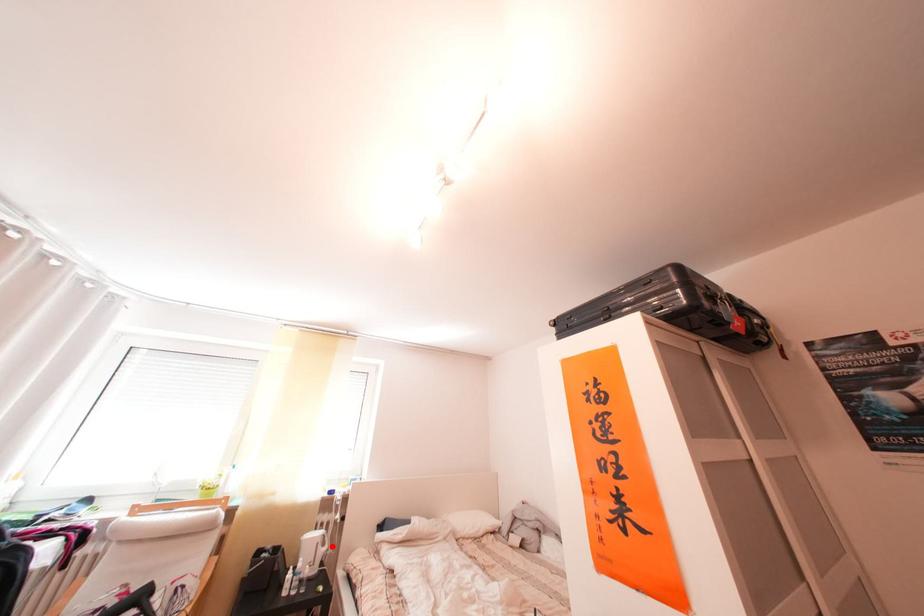
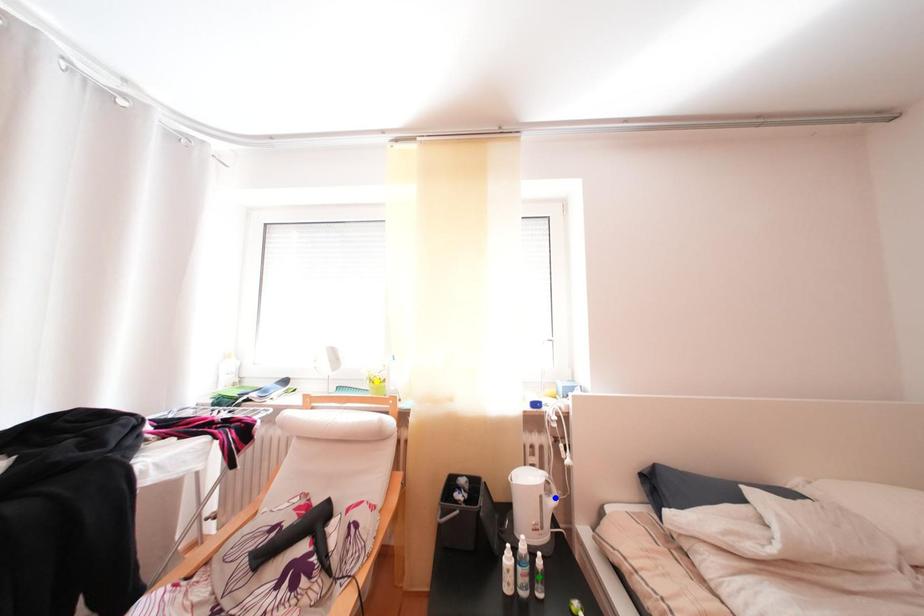
Question: I am providing you with two images of the same scene from different viewpoints. A red point is marked on the first image. You are given multiple points on the second image. Which point in image 2 is actually the same real-world point as the red point in image 1?

Choices:
 (A) blue point
 (B) green point
 (C) yellow point

Answer: (A)